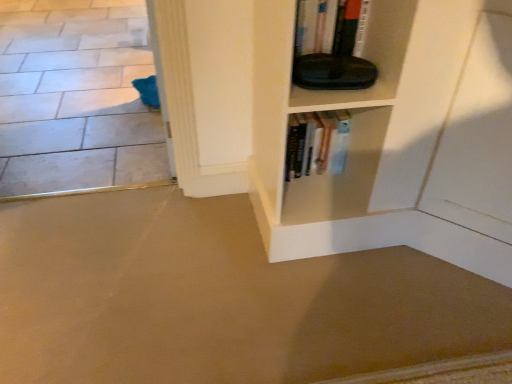
What do you see at coordinates (76, 99) in the screenshot? This screenshot has height=384, width=512. I see `white tile floor at lower left, placed as the 1th concrete when sorted from top to bottom` at bounding box center [76, 99].

Identify the location of hardcover books at center. This screenshot has height=384, width=512. (317, 143).

Measure the distance between point (322, 135) and camera.

A distance of 5.10 feet exists between point (322, 135) and camera.

Find the location of `beige carpet at lower left, acting as the 2th concrete starting from the top`. beige carpet at lower left, acting as the 2th concrete starting from the top is located at coordinates [218, 298].

Can you confirm if hardcover books at center is shorter than white tile floor at lower left, which is the second concrete in front-to-back order?

In fact, hardcover books at center may be taller than white tile floor at lower left, which is the second concrete in front-to-back order.

Considering the relative sizes of hardcover books at center and white tile floor at lower left, which appears as the first concrete when viewed from the back, in the image provided, is hardcover books at center thinner than white tile floor at lower left, which appears as the first concrete when viewed from the back,?

Indeed, hardcover books at center has a lesser width compared to white tile floor at lower left, which appears as the first concrete when viewed from the back.

Is hardcover books at center oriented away from white tile floor at lower left, which appears as the first concrete when viewed from the back?

No, white tile floor at lower left, which appears as the first concrete when viewed from the back, is not at the back of hardcover books at center.

Considering the relative sizes of white tile floor at lower left, which is the second concrete in front-to-back order, and beige carpet at lower left, the first concrete when ordered from front to back, in the image provided, is white tile floor at lower left, which is the second concrete in front-to-back order, thinner than beige carpet at lower left, the first concrete when ordered from front to back,?

In fact, white tile floor at lower left, which is the second concrete in front-to-back order, might be wider than beige carpet at lower left, the first concrete when ordered from front to back.

From the image's perspective, would you say white tile floor at lower left, placed as the 1th concrete when sorted from top to bottom, is shown under beige carpet at lower left, which appears as the 1th concrete when ordered from the bottom?

Incorrect, from the image's perspective, white tile floor at lower left, placed as the 1th concrete when sorted from top to bottom, is higher than beige carpet at lower left, which appears as the 1th concrete when ordered from the bottom.

Locate an element on the screen. concrete that is behind the beige carpet at lower left, which appears as the 1th concrete when ordered from the bottom is located at coordinates (76, 99).

Is white tile floor at lower left, which appears as the first concrete when viewed from the back, turned away from beige carpet at lower left, which appears as the 1th concrete when ordered from the bottom?

No.

This screenshot has width=512, height=384. I want to click on concrete that is the 1st object directly below the hardcover books at center (from a real-world perspective), so click(x=218, y=298).

Is hardcover books at center positioned far away from beige carpet at lower left, marked as the second concrete in a back-to-front arrangement?

Actually, hardcover books at center and beige carpet at lower left, marked as the second concrete in a back-to-front arrangement, are a little close together.

Is point (305, 140) positioned after point (179, 236)?

No.

Is hardcover books at center wider or thinner than beige carpet at lower left, marked as the second concrete in a back-to-front arrangement?

Considering their sizes, hardcover books at center looks slimmer than beige carpet at lower left, marked as the second concrete in a back-to-front arrangement.

From a real-world perspective, relative to hardcover books at center, is white tile floor at lower left, which is the second concrete in bottom-to-top order, vertically above or below?

From a real-world perspective, white tile floor at lower left, which is the second concrete in bottom-to-top order, is physically below hardcover books at center.

Who is smaller, white tile floor at lower left, which is the second concrete in bottom-to-top order, or hardcover books at center?

hardcover books at center.

Is hardcover books at center completely or partially inside white tile floor at lower left, placed as the 1th concrete when sorted from top to bottom?

No, white tile floor at lower left, placed as the 1th concrete when sorted from top to bottom, does not contain hardcover books at center.

Is white tile floor at lower left, which is the second concrete in front-to-back order, oriented towards hardcover books at center?

No.

Between beige carpet at lower left, marked as the second concrete in a back-to-front arrangement, and hardcover books at center, which one is positioned behind?

hardcover books at center is further away from the camera.

From a real-world perspective, is beige carpet at lower left, the first concrete when ordered from front to back, on hardcover books at center?

No, from a real-world perspective, beige carpet at lower left, the first concrete when ordered from front to back, is not above hardcover books at center.

Is beige carpet at lower left, acting as the 2th concrete starting from the top, smaller than hardcover books at center?

No.

Which is closer to the camera, (x=426, y=325) or (x=298, y=148)?

The point (x=426, y=325) is more forward.

Is beige carpet at lower left, the first concrete when ordered from front to back, bigger than white tile floor at lower left, which appears as the first concrete when viewed from the back?

Incorrect, beige carpet at lower left, the first concrete when ordered from front to back, is not larger than white tile floor at lower left, which appears as the first concrete when viewed from the back.

Choose the correct answer: Is beige carpet at lower left, which appears as the 1th concrete when ordered from the bottom, inside white tile floor at lower left, which is the second concrete in front-to-back order, or outside it?

beige carpet at lower left, which appears as the 1th concrete when ordered from the bottom, is spatially situated outside white tile floor at lower left, which is the second concrete in front-to-back order.

Considering the points (237, 250) and (118, 186), which point is behind, point (237, 250) or point (118, 186)?

The point (118, 186) is behind.

In the scene shown: Is the position of beige carpet at lower left, the first concrete when ordered from front to back, less distant than that of white tile floor at lower left, which is the second concrete in front-to-back order?

Yes.

The height and width of the screenshot is (384, 512). Find the location of `concrete that is the 2nd object directly below the hardcover books at center (from a real-world perspective)`. concrete that is the 2nd object directly below the hardcover books at center (from a real-world perspective) is located at coordinates (76, 99).

Find the location of a particular element. concrete located below the white tile floor at lower left, which is the second concrete in front-to-back order (from the image's perspective) is located at coordinates (218, 298).

From the image, which object appears to be nearer to white tile floor at lower left, which appears as the first concrete when viewed from the back, beige carpet at lower left, acting as the 2th concrete starting from the top, or hardcover books at center?

Based on the image, beige carpet at lower left, acting as the 2th concrete starting from the top, appears to be nearer to white tile floor at lower left, which appears as the first concrete when viewed from the back.

Which object lies further to the anchor point beige carpet at lower left, the first concrete when ordered from front to back, hardcover books at center or white tile floor at lower left, which appears as the first concrete when viewed from the back?

white tile floor at lower left, which appears as the first concrete when viewed from the back, is positioned further to the anchor beige carpet at lower left, the first concrete when ordered from front to back.

When comparing their distances from beige carpet at lower left, which appears as the 1th concrete when ordered from the bottom, does white tile floor at lower left, placed as the 1th concrete when sorted from top to bottom, or hardcover books at center seem further?

Based on the image, white tile floor at lower left, placed as the 1th concrete when sorted from top to bottom, appears to be further to beige carpet at lower left, which appears as the 1th concrete when ordered from the bottom.

Looking at the image, which one is located further to hardcover books at center, beige carpet at lower left, the first concrete when ordered from front to back, or white tile floor at lower left, placed as the 1th concrete when sorted from top to bottom?

white tile floor at lower left, placed as the 1th concrete when sorted from top to bottom.

Which object lies nearer to the anchor point white tile floor at lower left, which appears as the first concrete when viewed from the back, hardcover books at center or beige carpet at lower left, marked as the second concrete in a back-to-front arrangement?

The object closer to white tile floor at lower left, which appears as the first concrete when viewed from the back, is beige carpet at lower left, marked as the second concrete in a back-to-front arrangement.

Estimate the real-world distances between objects in this image. Which object is closer to hardcover books at center, white tile floor at lower left, placed as the 1th concrete when sorted from top to bottom, or beige carpet at lower left, the first concrete when ordered from front to back?

Among the two, beige carpet at lower left, the first concrete when ordered from front to back, is located nearer to hardcover books at center.

Where is `concrete between white tile floor at lower left, which is the second concrete in front-to-back order, and hardcover books at center, in the horizontal direction`? This screenshot has height=384, width=512. concrete between white tile floor at lower left, which is the second concrete in front-to-back order, and hardcover books at center, in the horizontal direction is located at coordinates (218, 298).